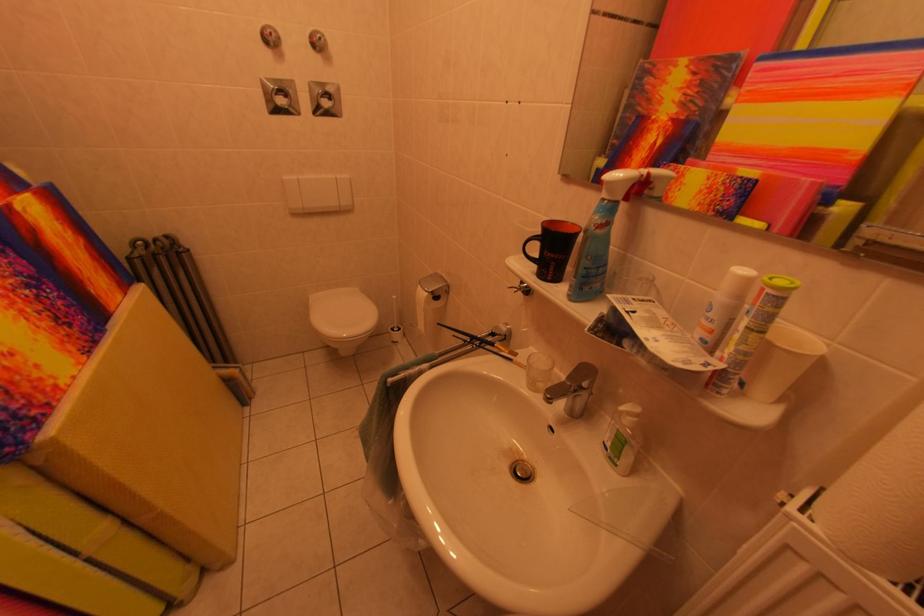
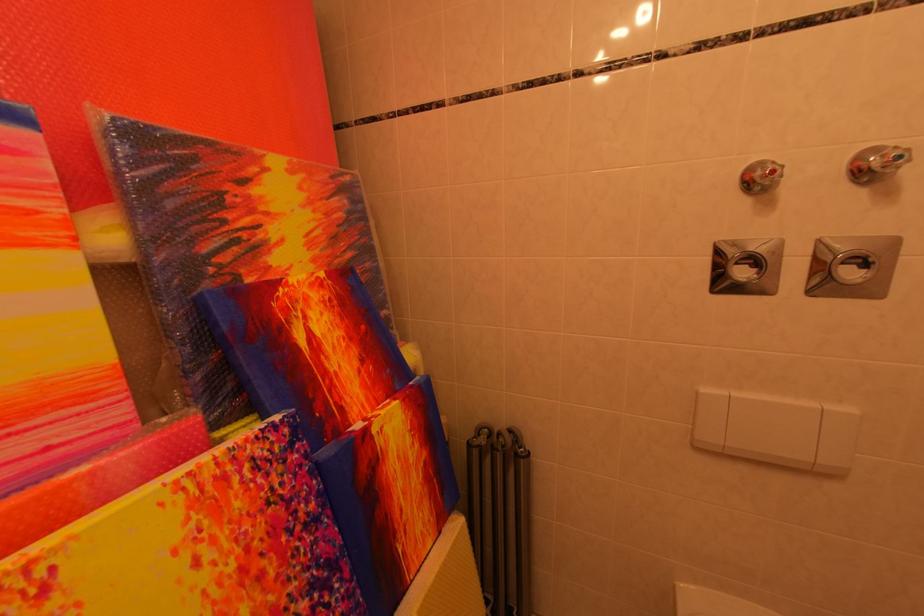
Find the pixel in the second image that matches (278,39) in the first image.

(782, 176)